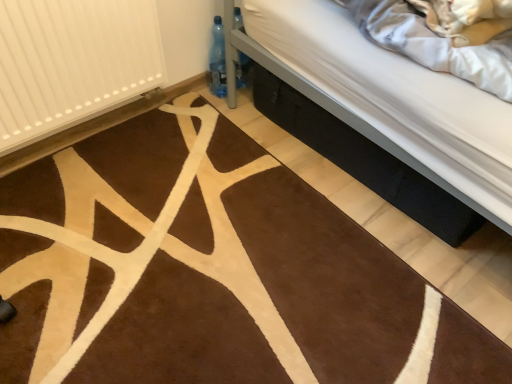
Locate an element on the screen. This screenshot has width=512, height=384. vacant space underneath white ribbed radiator at left (from a real-world perspective) is located at coordinates (104, 134).